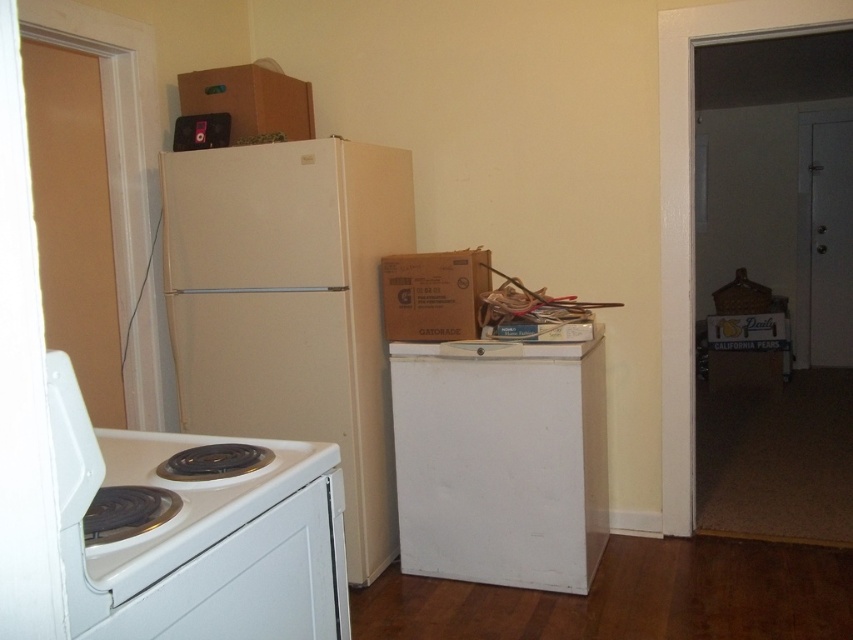
Is point (531, 385) closer to camera compared to point (421, 321)?

Yes, it is in front of point (421, 321).

From the picture: Who is positioned more to the left, white matte mini fridge at center or cardboard box at center?

Positioned to the left is cardboard box at center.

Where is `white matte mini fridge at center`? This screenshot has width=853, height=640. white matte mini fridge at center is located at coordinates (502, 461).

Does white matte refrigerator at center come behind cardboard box at center?

No, it is in front of cardboard box at center.

Between white matte refrigerator at center and cardboard box at center, which one appears on the right side from the viewer's perspective?

Positioned to the right is cardboard box at center.

Locate an element on the screen. white matte refrigerator at center is located at coordinates coord(291,307).

Find the location of a particular element. white matte refrigerator at center is located at coordinates (291, 307).

Is cardboard box at center thinner than cardboard box at upper center?

Yes, cardboard box at center is thinner than cardboard box at upper center.

Is point (422, 285) closer to viewer compared to point (186, 74)?

Yes, point (422, 285) is closer to viewer.

Where is `cardboard box at center`? Image resolution: width=853 pixels, height=640 pixels. cardboard box at center is located at coordinates (433, 294).